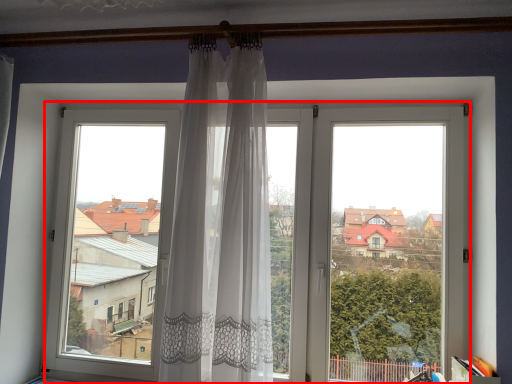
Question: From the image's perspective, where is window (annotated by the red box) located relative to curtain?

Choices:
 (A) below
 (B) above

Answer: (A)